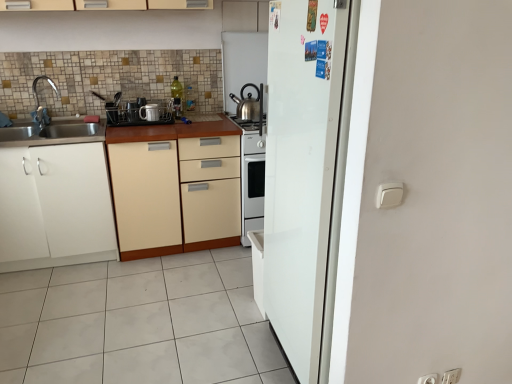
This screenshot has height=384, width=512. In order to click on blank space above white tile floor at lower center (from a real-world perspective) in this screenshot , I will do `click(132, 308)`.